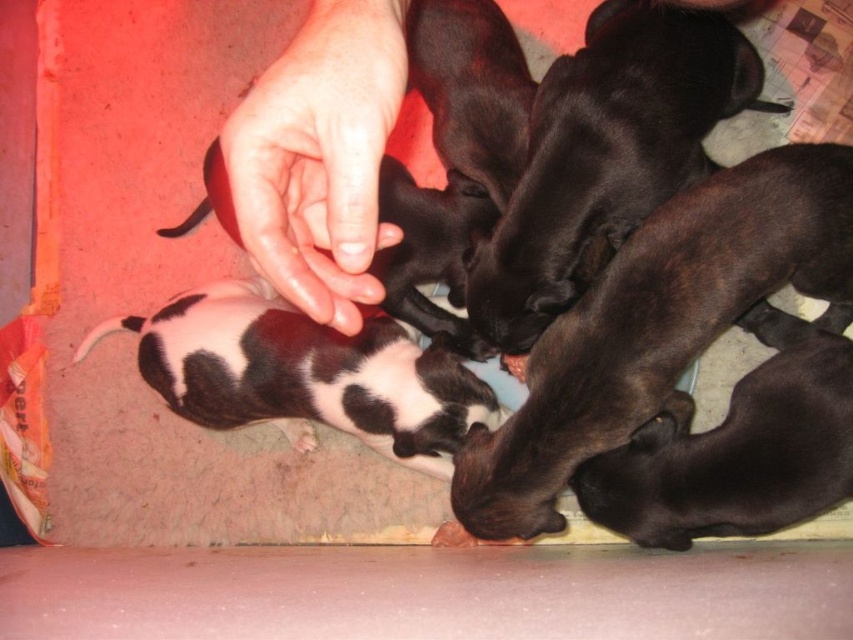
Question: Which is nearer to the spotted fur puppy at center?

Choices:
 (A) pink flesh at center
 (B) black matte dog at center
 (C) black matte dog at lower right

Answer: (B)

Question: Which point is farther to the camera?

Choices:
 (A) spotted fur puppy at center
 (B) black matte dog at center
 (C) black matte dog at lower right

Answer: (A)

Question: Does spotted fur puppy at center lie in front of black matte dog at lower right?

Choices:
 (A) yes
 (B) no

Answer: (B)

Question: Estimate the real-world distances between objects in this image. Which object is farther from the black matte dog at lower right?

Choices:
 (A) pink flesh at center
 (B) black matte dog at center
 (C) spotted fur puppy at center

Answer: (A)

Question: Is the position of black matte dog at center more distant than that of spotted fur puppy at center?

Choices:
 (A) yes
 (B) no

Answer: (B)

Question: Does pink flesh at center appear over spotted fur puppy at center?

Choices:
 (A) yes
 (B) no

Answer: (A)